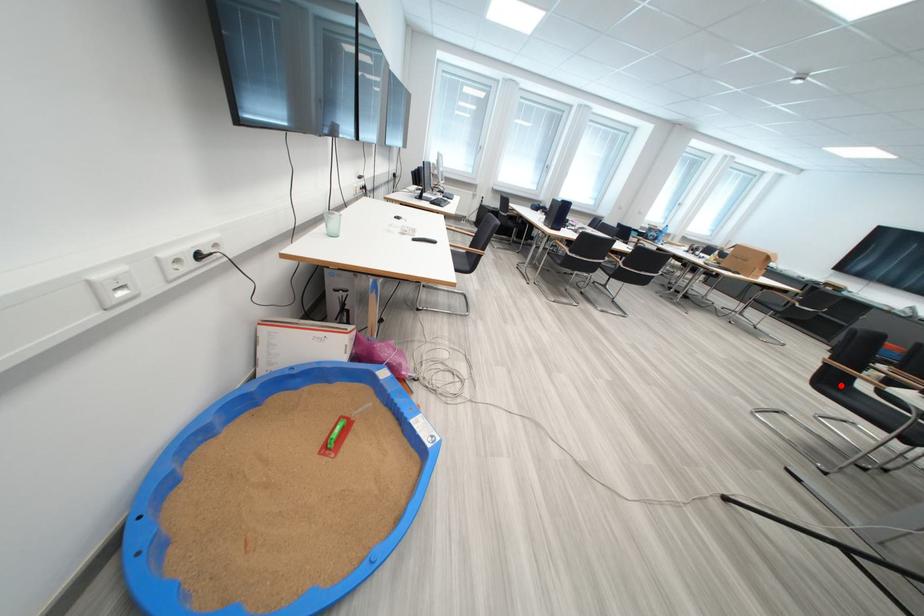
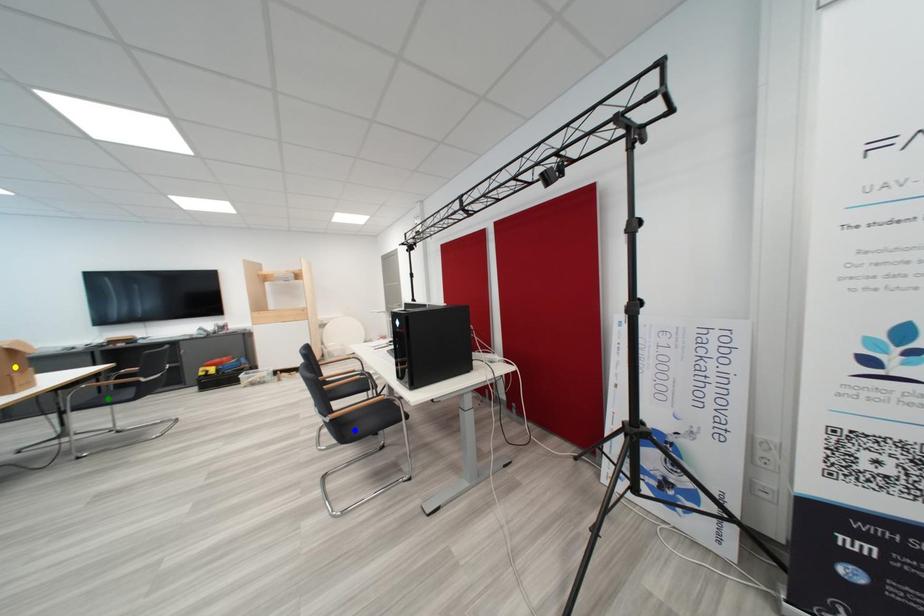
Question: I am providing you with two images of the same scene from different viewpoints. A red point is marked on the first image. You are given multiple points on the second image. Which point in image 2 represents the same 3d spot as the red point in image 1?

Choices:
 (A) yellow point
 (B) blue point
 (C) green point

Answer: (B)